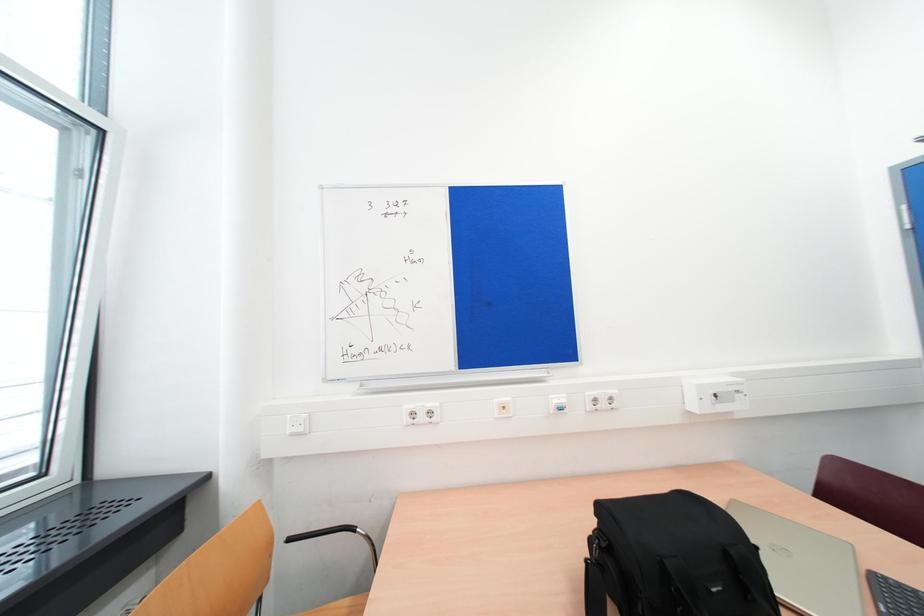
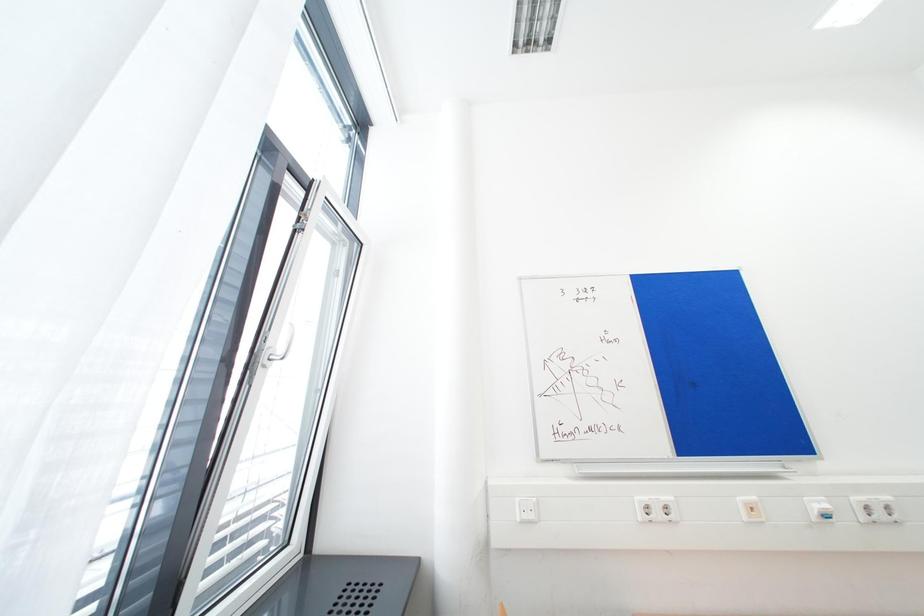
Question: What movement of the cameraman would produce the second image?

Choices:
 (A) Left
 (B) Right
 (C) Forward
 (D) Backward

Answer: (A)